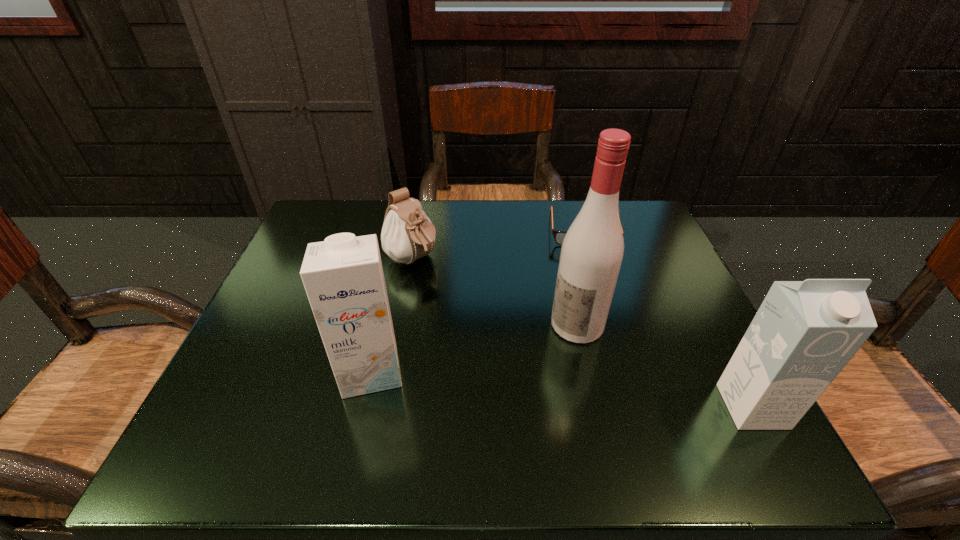
Identify the location of free space located 0.100m on the label of the tallest object. [x=524, y=366].

You are a GUI agent. You are given a task and a screenshot of the screen. Output one action in this format:
    pyautogui.click(x=<x>, y=<y>)
    Task: Click on the free point located 0.150m on the label of the tallest object
    This screenshot has width=960, height=540.
    Given the screenshot: What is the action you would take?
    pyautogui.click(x=504, y=382)

Locate an element on the screen. The height and width of the screenshot is (540, 960). vacant space located on the front-facing side of the pouch is located at coordinates (566, 379).

Where is `vacant point located 0.240m on the front-facing side of the pouch`? This screenshot has width=960, height=540. vacant point located 0.240m on the front-facing side of the pouch is located at coordinates (505, 333).

The image size is (960, 540). In order to click on free space located on the front-facing side of the pouch in this screenshot , I will do `click(468, 303)`.

The height and width of the screenshot is (540, 960). In order to click on spectacles that is at the far edge in this screenshot , I will do pos(559,236).

I want to click on pouch present at the far edge, so click(407, 235).

At what (x,y) coordinates should I click in order to perform the action: click on carton located in the right edge section of the desktop. Please return your answer as a coordinate pair (x, y). Looking at the image, I should click on (804, 333).

Where is `spectacles located at the right edge`? The image size is (960, 540). spectacles located at the right edge is located at coordinates pos(559,236).

You are a GUI agent. You are given a task and a screenshot of the screen. Output one action in this format:
    pyautogui.click(x=<x>, y=<y>)
    Task: Click on the object that is at the far right corner
    This screenshot has height=540, width=960.
    Given the screenshot: What is the action you would take?
    pyautogui.click(x=559, y=236)